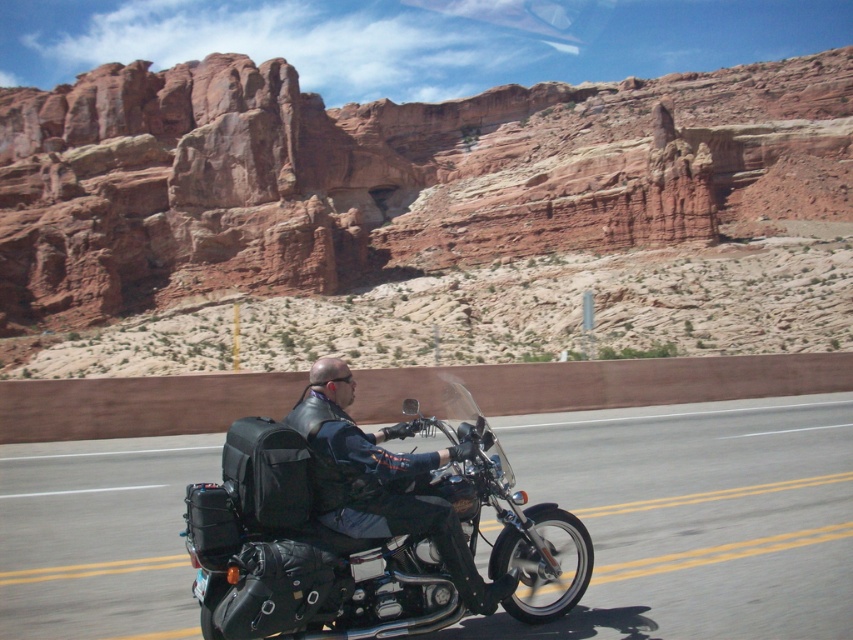
Identify the location of black leather motorcycle at center. (697, 516).

At what (x,y) coordinates should I click in order to perform the action: click on black leather motorcycle at center. Please return your answer as a coordinate pair (x, y). Image resolution: width=853 pixels, height=640 pixels. Looking at the image, I should click on (697, 516).

Does shiny black motorcycle at center have a larger size compared to black fabric backpack at lower left?

Yes.

This screenshot has height=640, width=853. What do you see at coordinates (302, 550) in the screenshot?
I see `shiny black motorcycle at center` at bounding box center [302, 550].

This screenshot has height=640, width=853. What are the coordinates of `shiny black motorcycle at center` in the screenshot? It's located at (302, 550).

Identify the location of shiny black motorcycle at center. The width and height of the screenshot is (853, 640). (302, 550).

Does point (802, 588) lie in front of point (242, 496)?

That is False.

Is point (538, 461) behind point (289, 451)?

Yes, it is behind point (289, 451).

Identify the location of black leather motorcycle at center. This screenshot has height=640, width=853. (697, 516).